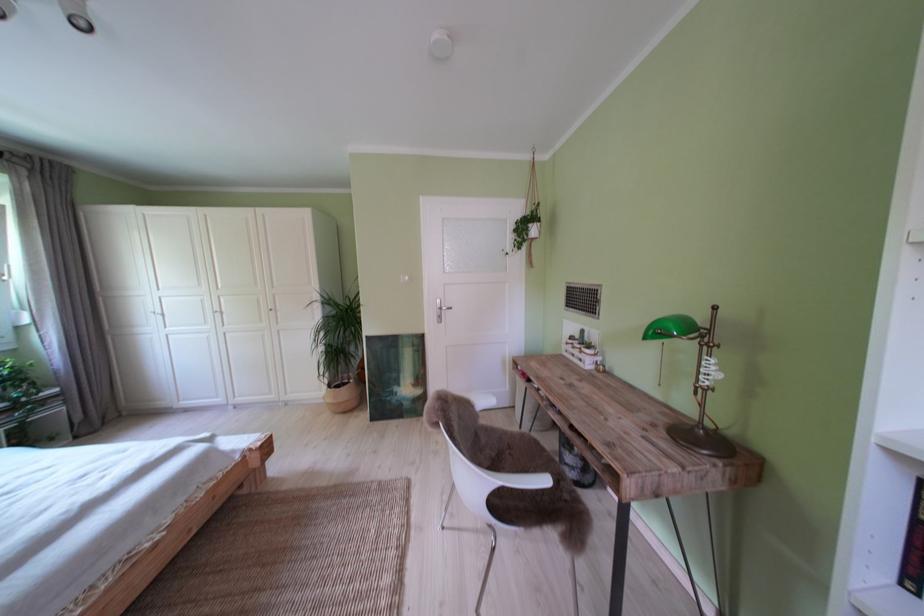
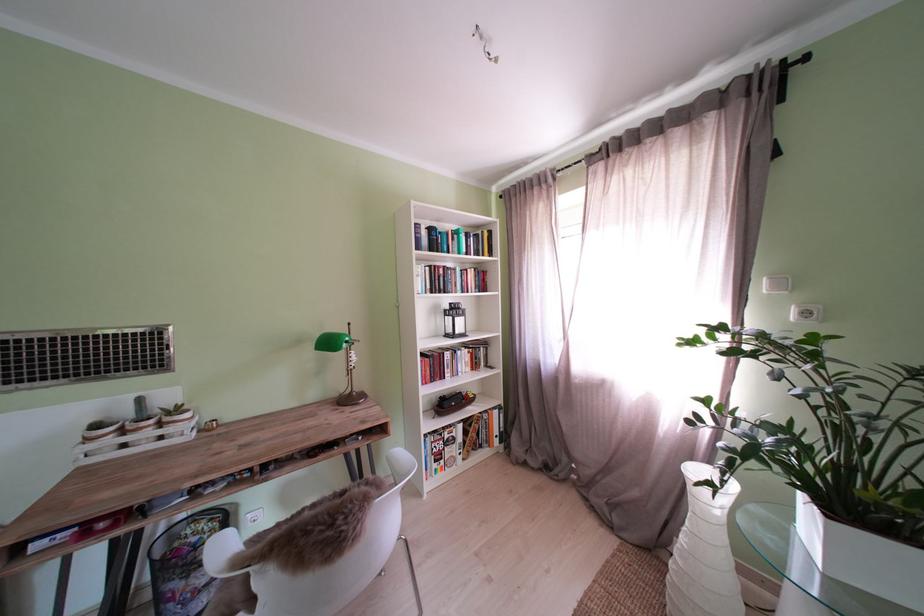
Where in the second image is the point corresponding to (x=590, y=352) from the first image?

(163, 427)